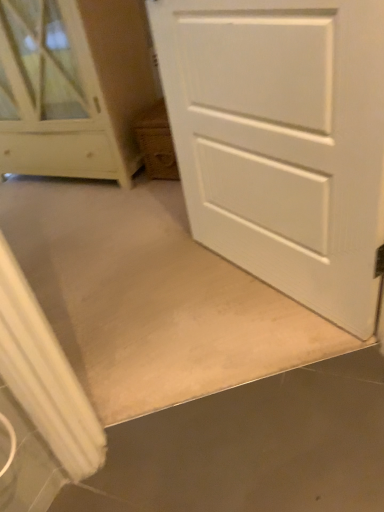
Describe the element at coordinates (68, 87) in the screenshot. I see `white wood chest of drawers at upper left` at that location.

Find the location of a particular element. white wood chest of drawers at upper left is located at coordinates (68, 87).

Measure the distance between white wood chest of drawers at upper left and camera.

The depth of white wood chest of drawers at upper left is 1.83 meters.

This screenshot has width=384, height=512. In order to click on white matte door at center in this screenshot , I will do `click(282, 141)`.

Consider the image. In order to face white matte door at center, should I rotate leftwards or rightwards?

To align with it, rotate right about 8.369°.

What do you see at coordinates (282, 141) in the screenshot? The height and width of the screenshot is (512, 384). I see `white matte door at center` at bounding box center [282, 141].

At what (x,y) coordinates should I click in order to perform the action: click on white wood chest of drawers at upper left. Please return your answer as a coordinate pair (x, y). This screenshot has width=384, height=512. Looking at the image, I should click on (x=68, y=87).

Which object is positioned more to the left, white wood chest of drawers at upper left or white matte door at center?

From the viewer's perspective, white wood chest of drawers at upper left appears more on the left side.

Between white wood chest of drawers at upper left and white matte door at center, which one is positioned behind?

white wood chest of drawers at upper left is further from the camera.

Considering the points (91, 65) and (190, 12), which point is in front, point (91, 65) or point (190, 12)?

Point (190, 12)

From the image's perspective, is white wood chest of drawers at upper left on top of white matte door at center?

Yes, from the image's perspective, white wood chest of drawers at upper left is above white matte door at center.

From a real-world perspective, is white wood chest of drawers at upper left on top of white matte door at center?

Yes, from a real-world perspective, white wood chest of drawers at upper left is over white matte door at center

From the picture: Considering the relative sizes of white wood chest of drawers at upper left and white matte door at center in the image provided, is white wood chest of drawers at upper left wider than white matte door at center?

Indeed, white wood chest of drawers at upper left has a greater width compared to white matte door at center.

Which of these two, white wood chest of drawers at upper left or white matte door at center, stands shorter?

white matte door at center.

Can you confirm if white wood chest of drawers at upper left is smaller than white matte door at center?

No, white wood chest of drawers at upper left is not smaller than white matte door at center.

Is white wood chest of drawers at upper left inside or outside of white matte door at center?

white wood chest of drawers at upper left is not inside white matte door at center, it's outside.

Is white wood chest of drawers at upper left next to white matte door at center and touching it?

No, white wood chest of drawers at upper left is not beside white matte door at center.

Is white wood chest of drawers at upper left turned away from white matte door at center?

No, white wood chest of drawers at upper left is not facing the opposite direction of white matte door at center.

Find the location of a particular element. door that appears below the white wood chest of drawers at upper left (from a real-world perspective) is located at coordinates (282, 141).

Is white matte door at center to the left of white wood chest of drawers at upper left from the viewer's perspective?

No.

Which object is closer to the camera taking this photo, white matte door at center or white wood chest of drawers at upper left?

white matte door at center.

Is point (340, 213) positioned after point (29, 9)?

That is False.

From the image's perspective, is white matte door at center located above white wood chest of drawers at upper left?

Actually, white matte door at center appears below white wood chest of drawers at upper left in the image.

From a real-world perspective, is white matte door at center located higher than white wood chest of drawers at upper left?

No.

Is white matte door at center thinner than white wood chest of drawers at upper left?

Yes, white matte door at center is thinner than white wood chest of drawers at upper left.

Can you confirm if white matte door at center is taller than white wood chest of drawers at upper left?

No, white matte door at center is not taller than white wood chest of drawers at upper left.

Between white matte door at center and white wood chest of drawers at upper left, which one has larger size?

white wood chest of drawers at upper left is bigger.

Is white matte door at center surrounding white wood chest of drawers at upper left?

No, white wood chest of drawers at upper left is not a part of white matte door at center.

Is white matte door at center far from white wood chest of drawers at upper left?

Yes.

Is white matte door at center looking in the opposite direction of white wood chest of drawers at upper left?

No.

How many degrees apart are the facing directions of white matte door at center and white wood chest of drawers at upper left?

30 degrees separate the facing orientations of white matte door at center and white wood chest of drawers at upper left.

Where is `door below the white wood chest of drawers at upper left (from the image's perspective)`? The image size is (384, 512). door below the white wood chest of drawers at upper left (from the image's perspective) is located at coordinates (282, 141).

The width and height of the screenshot is (384, 512). In the image, there is a white matte door at center. In order to click on the chest of drawers above it (from the image's perspective) in this screenshot , I will do `click(68, 87)`.

Find the location of `chest of drawers on the left of white matte door at center`. chest of drawers on the left of white matte door at center is located at coordinates (x=68, y=87).